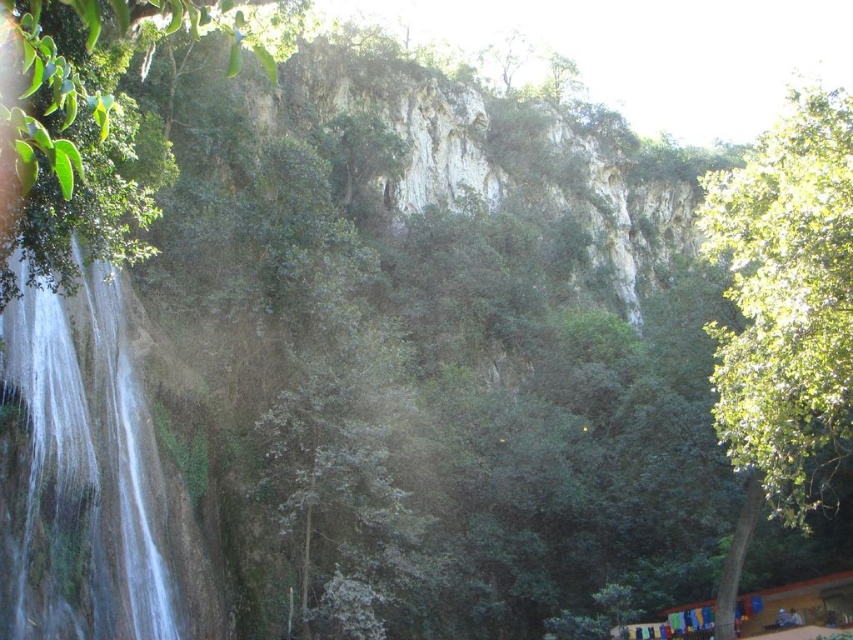
Is green leafy tree at right taller than white smooth waterfall at left?

Yes, green leafy tree at right is taller than white smooth waterfall at left.

Which is behind, point (732, 461) or point (113, 356)?

The point (113, 356) is behind.

Identify the location of green leafy tree at right. (786, 301).

Is the position of white smooth waterfall at left more distant than that of green leafy tree at left?

Yes, it is behind green leafy tree at left.

Is white smooth waterfall at left to the right of green leafy tree at left from the viewer's perspective?

In fact, white smooth waterfall at left is to the left of green leafy tree at left.

Locate an element on the screen. The image size is (853, 640). white smooth waterfall at left is located at coordinates (85, 468).

This screenshot has width=853, height=640. I want to click on white smooth waterfall at left, so click(x=85, y=468).

Which is behind, point (733, 385) or point (126, 4)?

Positioned behind is point (733, 385).

Can you confirm if green leafy tree at right is positioned above green leafy tree at left?

Incorrect, green leafy tree at right is not positioned above green leafy tree at left.

Does point (833, 186) come farther from viewer compared to point (3, 157)?

Yes, point (833, 186) is farther from viewer.

Identify the location of green leafy tree at right. (786, 301).